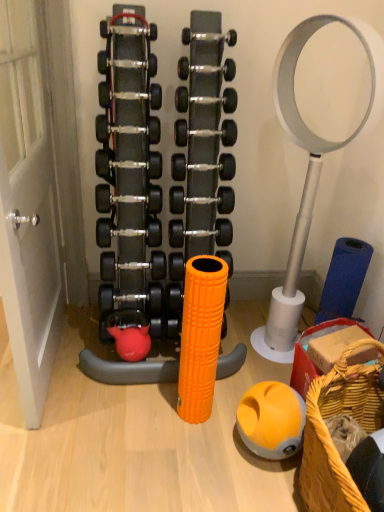
The height and width of the screenshot is (512, 384). I want to click on vacant space to the left of orange textured foam roller at center, so click(x=155, y=407).